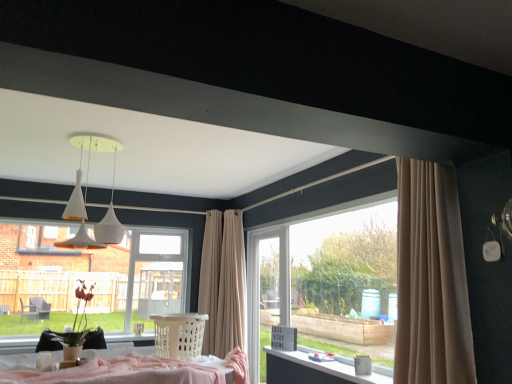
Question: Is white plastic laundry basket at center oriented towards white glossy table at lower right?

Choices:
 (A) yes
 (B) no

Answer: (B)

Question: Is white plastic laundry basket at center with white glossy table at lower right?

Choices:
 (A) yes
 (B) no

Answer: (B)

Question: Is white plastic laundry basket at center to the left of white glossy table at lower right from the viewer's perspective?

Choices:
 (A) no
 (B) yes

Answer: (B)

Question: Is white plastic laundry basket at center turned away from white glossy table at lower right?

Choices:
 (A) no
 (B) yes

Answer: (A)

Question: Is white plastic laundry basket at center taller than white glossy table at lower right?

Choices:
 (A) no
 (B) yes

Answer: (B)

Question: From a real-world perspective, relative to white plastic laundry basket at center, is beige fabric curtain at center vertically above or below?

Choices:
 (A) below
 (B) above

Answer: (B)

Question: In terms of size, does beige fabric curtain at center appear bigger or smaller than white plastic laundry basket at center?

Choices:
 (A) big
 (B) small

Answer: (A)

Question: Do you think beige fabric curtain at center is within white plastic laundry basket at center, or outside of it?

Choices:
 (A) outside
 (B) inside

Answer: (A)

Question: In terms of height, does beige fabric curtain at center look taller or shorter compared to white plastic laundry basket at center?

Choices:
 (A) tall
 (B) short

Answer: (A)

Question: Looking at their shapes, would you say clear glass window at center is wider or thinner than white plastic laundry basket at center?

Choices:
 (A) wide
 (B) thin

Answer: (B)

Question: Relative to white plastic laundry basket at center, is clear glass window at center in front or behind?

Choices:
 (A) behind
 (B) front

Answer: (A)

Question: From a real-world perspective, relative to white plastic laundry basket at center, is clear glass window at center vertically above or below?

Choices:
 (A) above
 (B) below

Answer: (A)

Question: Considering the positions of point (33, 251) and point (165, 322), is point (33, 251) closer or farther from the camera than point (165, 322)?

Choices:
 (A) closer
 (B) farther

Answer: (A)

Question: In terms of size, does white glossy table at lower right appear bigger or smaller than clear glass window at center?

Choices:
 (A) small
 (B) big

Answer: (A)

Question: Considering the positions of point (371, 380) and point (156, 256), is point (371, 380) closer or farther from the camera than point (156, 256)?

Choices:
 (A) farther
 (B) closer

Answer: (B)